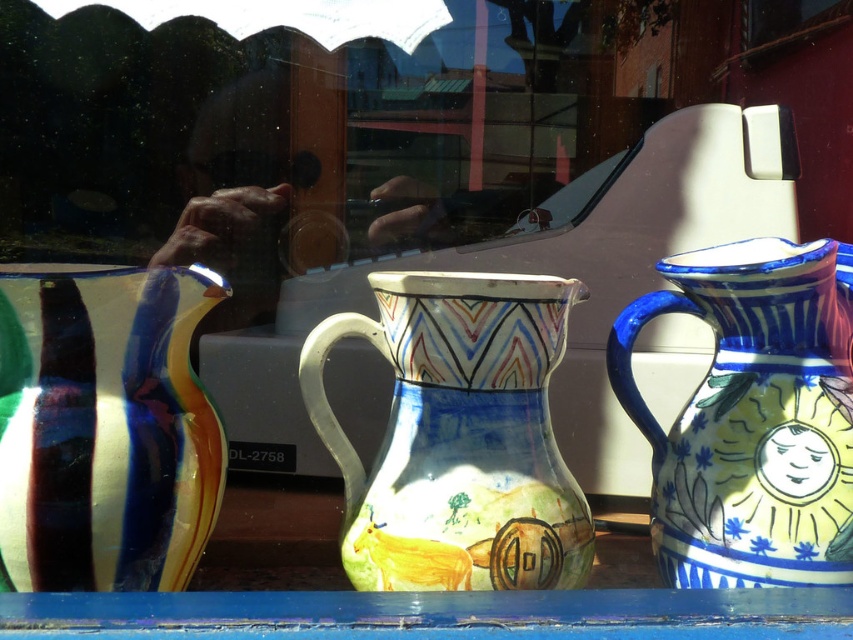
Question: Does shiny ceramic jug at left have a lesser width compared to blue glazed jug at right?

Choices:
 (A) yes
 (B) no

Answer: (A)

Question: Which of the following is the farthest from the observer?

Choices:
 (A) (317, 611)
 (B) (57, 512)

Answer: (B)

Question: Can you confirm if shiny ceramic jug at left is positioned to the left of blue painted wood at lower center?

Choices:
 (A) yes
 (B) no

Answer: (A)

Question: Which of the following is the farthest from the observer?

Choices:
 (A) blue painted wood at lower center
 (B) hand-painted ceramic jug at center
 (C) shiny ceramic jug at left

Answer: (B)

Question: Does hand-painted ceramic jug at center have a smaller size compared to blue glazed jug at right?

Choices:
 (A) no
 (B) yes

Answer: (B)

Question: Among these objects, which one is farthest from the camera?

Choices:
 (A) blue glazed jug at right
 (B) blue painted wood at lower center

Answer: (A)